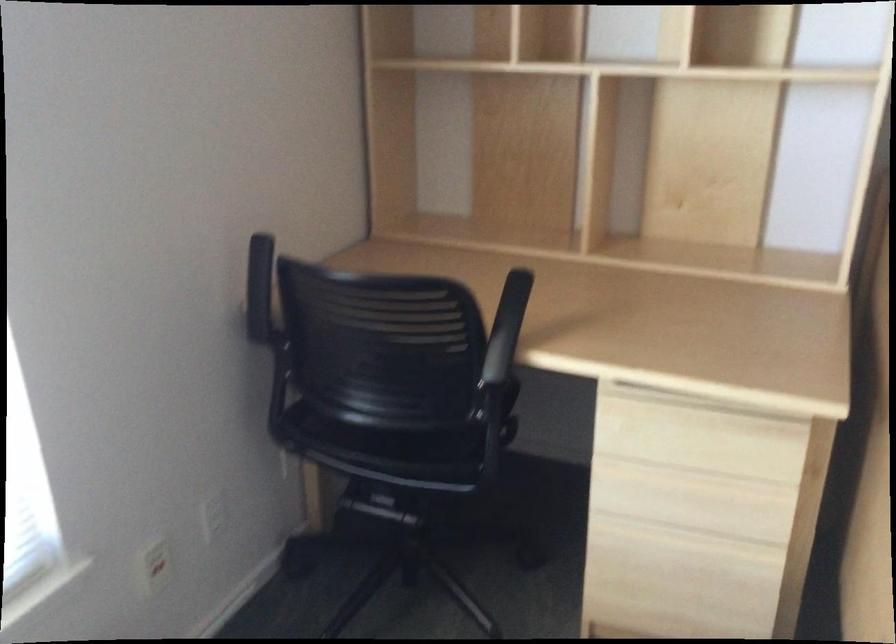
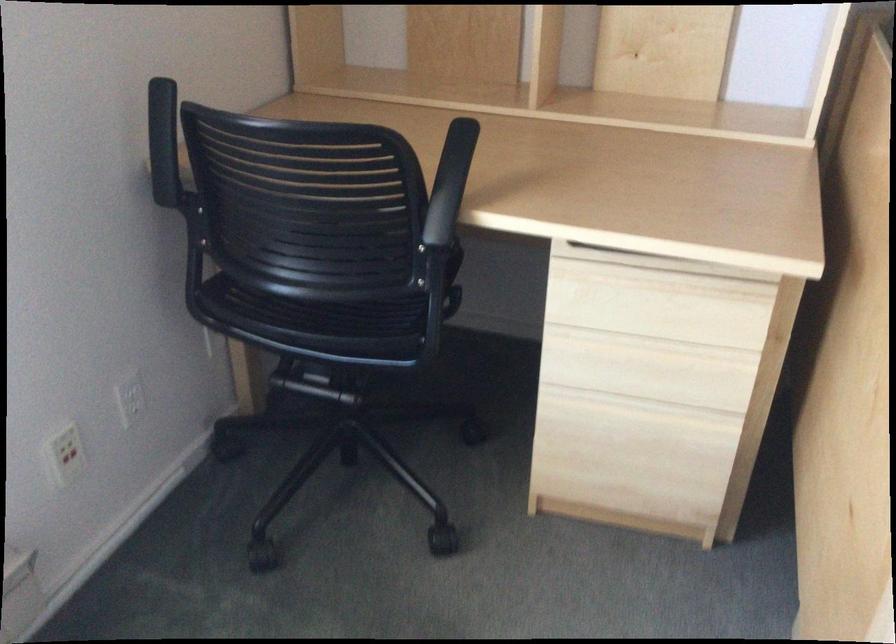
Find the pixel in the second image that matches point (695, 476) in the first image.

(652, 345)